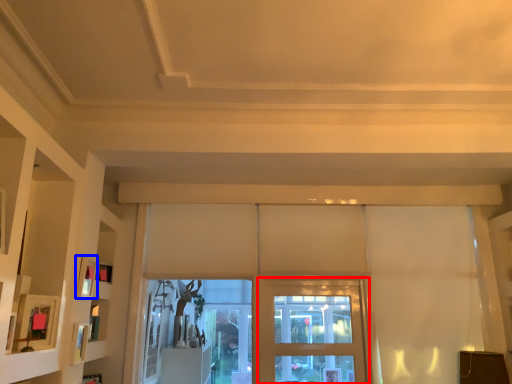
Question: Among these objects, which one is nearest to the camera, screen door (highlighted by a red box) or picture frame (highlighted by a blue box)?

Choices:
 (A) screen door
 (B) picture frame

Answer: (B)